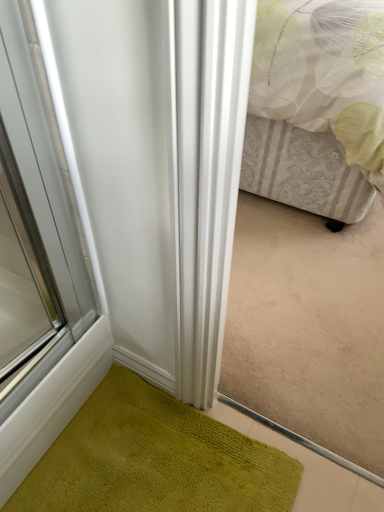
The height and width of the screenshot is (512, 384). In order to click on green textured bath mat at lower left in this screenshot , I will do `click(154, 459)`.

Describe the element at coordinates (154, 459) in the screenshot. I see `green textured bath mat at lower left` at that location.

Image resolution: width=384 pixels, height=512 pixels. I want to click on green textured bath mat at lower left, so click(154, 459).